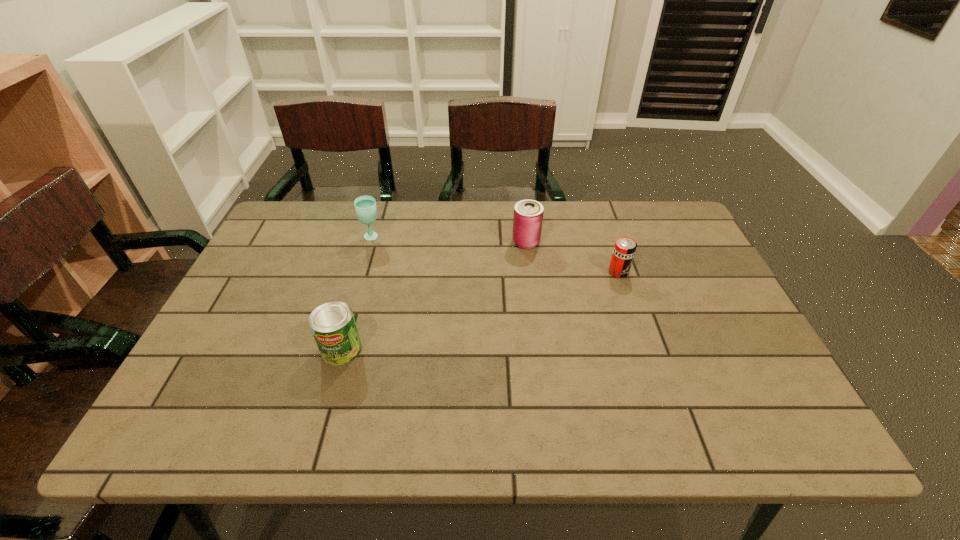
The height and width of the screenshot is (540, 960). Find the location of `blank space located on the back of the second nearest object`. blank space located on the back of the second nearest object is located at coordinates (601, 221).

Where is `glass that is positioned at the far edge`? glass that is positioned at the far edge is located at coordinates (365, 206).

The width and height of the screenshot is (960, 540). In order to click on can located in the far edge section of the desktop in this screenshot , I will do `click(528, 214)`.

Where is `vacant point at the far edge`? vacant point at the far edge is located at coordinates tap(606, 204).

You are a GUI agent. You are given a task and a screenshot of the screen. Output one action in this format:
    pyautogui.click(x=<x>, y=<y>)
    Task: Click on the blank space at the near edge
    
    Given the screenshot: What is the action you would take?
    pyautogui.click(x=601, y=421)

I want to click on vacant region at the left edge of the desktop, so click(252, 306).

In the image, there is a desktop. At what (x,y) coordinates should I click in order to perform the action: click on vacant space at the right edge. Please return your answer as a coordinate pair (x, y). Looking at the image, I should click on pos(710,403).

This screenshot has height=540, width=960. I want to click on vacant space at the far left corner of the desktop, so click(321, 223).

At what (x,y) coordinates should I click in order to perform the action: click on free space at the near left corner of the desktop. Please return your answer as a coordinate pair (x, y). The width and height of the screenshot is (960, 540). Looking at the image, I should click on (171, 443).

Identify the location of free space at the far right corner of the desktop. This screenshot has height=540, width=960. (659, 213).